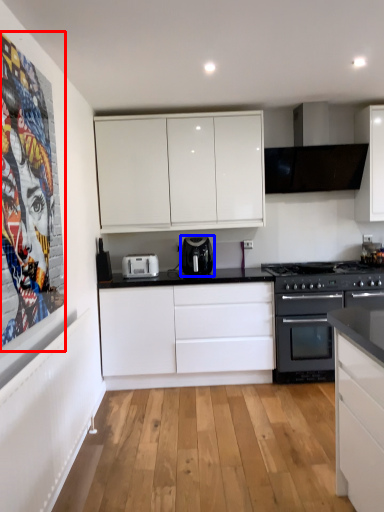
Question: Which object is further to the camera taking this photo, poster page (highlighted by a red box) or kitchen appliance (highlighted by a blue box)?

Choices:
 (A) poster page
 (B) kitchen appliance

Answer: (B)